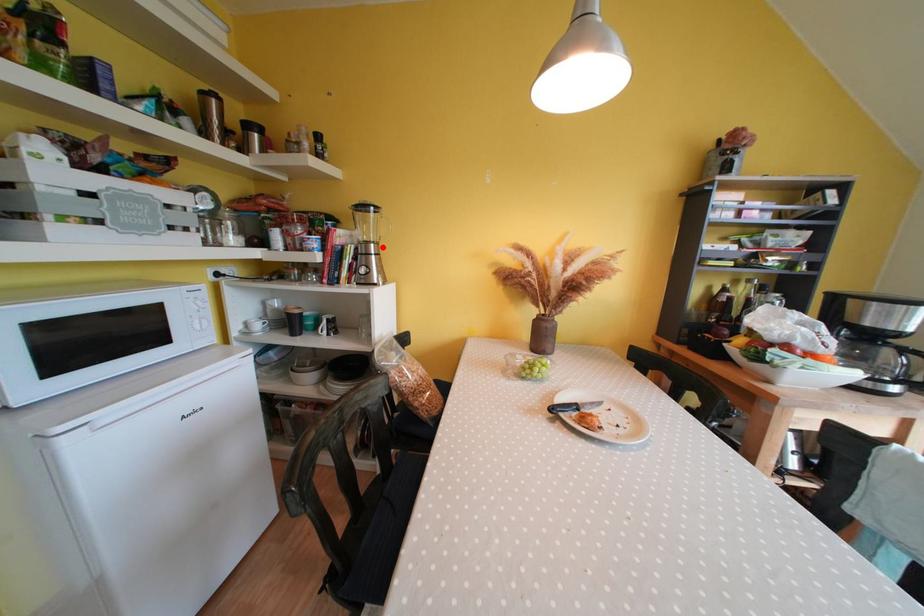
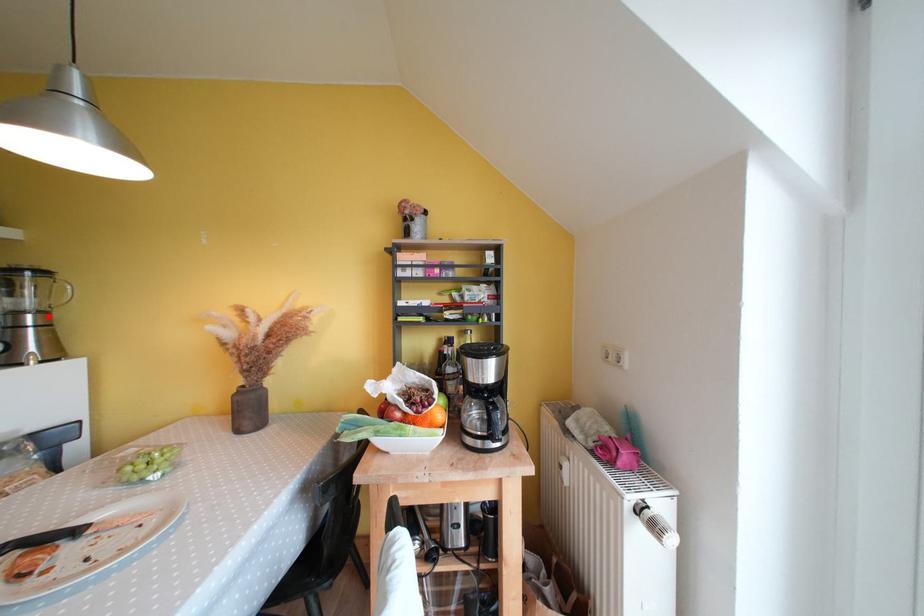
I am providing you with two images of the same scene from different viewpoints. A red point is marked on the first image and another point is marked on the second image. Is the red point in image1 aligned with the point shown in image2?

Yes